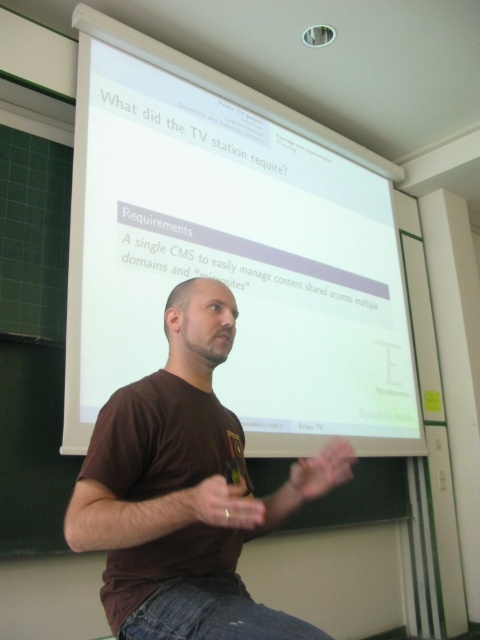
Question: Can you confirm if white matte projection screen at upper center is positioned above matte brown hand at center?

Choices:
 (A) no
 (B) yes

Answer: (B)

Question: Can you confirm if white matte projection screen at upper center is bigger than matte brown hand at center?

Choices:
 (A) yes
 (B) no

Answer: (A)

Question: Observing the image, what is the correct spatial positioning of matte brown hand at center in reference to matte brown hand at lower center?

Choices:
 (A) left
 (B) right

Answer: (A)

Question: Based on their relative distances, which object is farther from the white matte projection screen at upper center?

Choices:
 (A) brown cotton shirt at center
 (B) matte brown hand at center

Answer: (B)

Question: Which point is farther to the camera?

Choices:
 (A) white matte projection screen at upper center
 (B) matte brown hand at lower center

Answer: (A)

Question: Which of these objects is positioned closest to the matte brown hand at lower center?

Choices:
 (A) white matte projection screen at upper center
 (B) matte brown hand at center
 (C) brown cotton shirt at center

Answer: (B)